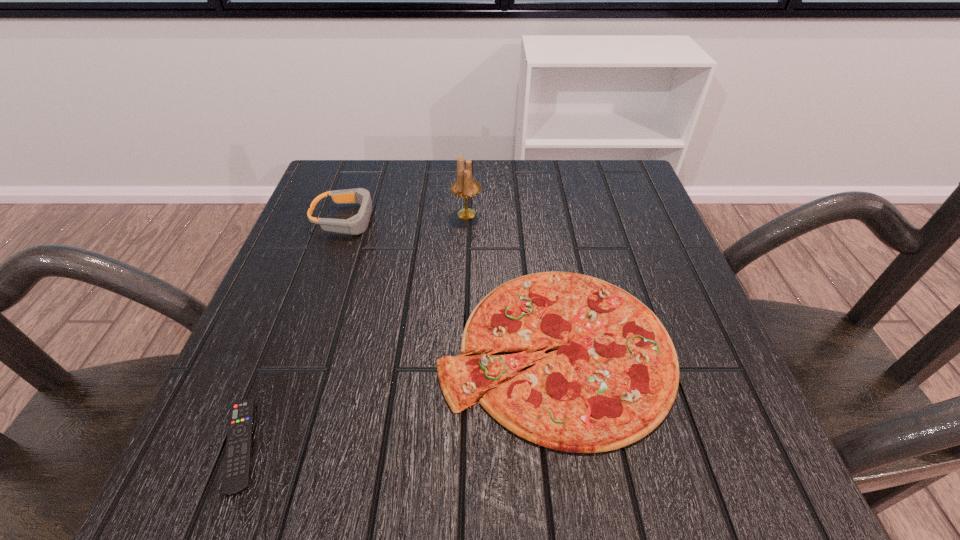
Find the location of `candle holder`. candle holder is located at coordinates (465, 186).

Locate an element on the screen. The width and height of the screenshot is (960, 540). goggles is located at coordinates (357, 224).

Where is `pizza`? The width and height of the screenshot is (960, 540). pizza is located at coordinates (614, 378).

Identify the location of the shortest object. The width and height of the screenshot is (960, 540). (237, 465).

Where is `vacant region located 0.150m on the left of the candle holder`? The image size is (960, 540). vacant region located 0.150m on the left of the candle holder is located at coordinates (386, 214).

This screenshot has width=960, height=540. Identify the location of vacant area located 0.160m on the front and back of the goggles. (451, 219).

At what (x,y) coordinates should I click in order to perform the action: click on vacant region located 0.180m on the back of the second shortest object. Please return your answer as a coordinate pair (x, y). The height and width of the screenshot is (540, 960). Looking at the image, I should click on pyautogui.click(x=537, y=219).

Locate an element on the screen. free space located 0.110m on the back of the shortest object is located at coordinates (280, 342).

Locate an element on the screen. This screenshot has width=960, height=540. candle holder that is at the far edge is located at coordinates (465, 186).

The width and height of the screenshot is (960, 540). In order to click on goggles located in the far edge section of the desktop in this screenshot , I will do `click(357, 224)`.